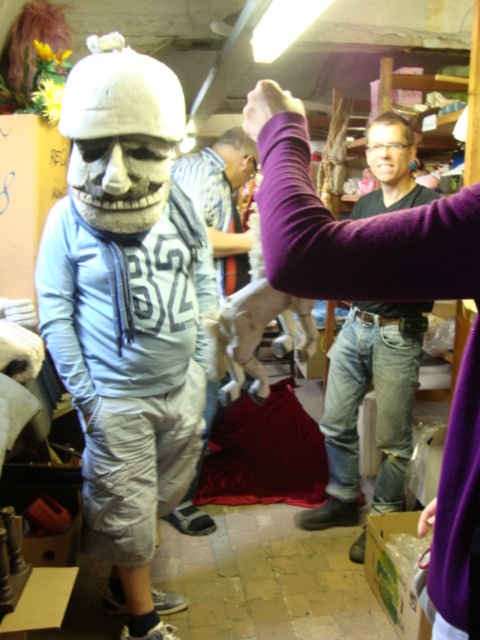
You are a photographer in the workshop and want to capture a clear photo of both the matte white mask at center and the matte black shirt at center. Since the camera can only focus on one object at a time, which object should you focus on to ensure it fills the frame more? Explain your reasoning based on their sizes.

The matte white mask at center has a larger width than the matte black shirt at center. Therefore, focusing on the matte white mask at center will ensure it fills the frame more due to its greater size.

You are standing in the workshop and need to locate the matte white mask at center. Based on the coordinates given, where would you find it?

The matte white mask at center is located at coordinates point (128,312).

You are standing in the workshop and need to locate the matte white mask at center. According to the coordinates provided, where should you look?

The matte white mask at center is located at coordinates point (128, 312).